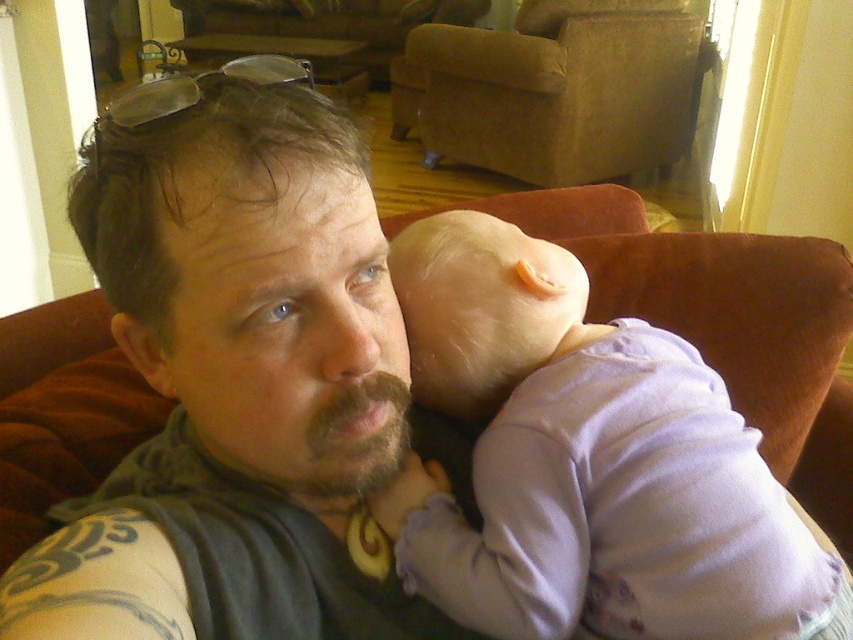
Question: Is dark gray vest at center positioned before purple soft fabric at center?

Choices:
 (A) yes
 (B) no

Answer: (A)

Question: Which is farther from the brown suede armchair at upper center?

Choices:
 (A) dark gray vest at center
 (B) purple soft fabric at center

Answer: (A)

Question: Does dark gray vest at center have a smaller size compared to purple soft fabric at center?

Choices:
 (A) no
 (B) yes

Answer: (A)

Question: Estimate the real-world distances between objects in this image. Which object is farther from the dark gray vest at center?

Choices:
 (A) purple soft fabric at center
 (B) brown suede armchair at upper center

Answer: (B)

Question: Estimate the real-world distances between objects in this image. Which object is closer to the dark gray vest at center?

Choices:
 (A) purple soft fabric at center
 (B) brown suede armchair at upper center

Answer: (A)

Question: Can you confirm if dark gray vest at center is bigger than brown suede armchair at upper center?

Choices:
 (A) no
 (B) yes

Answer: (A)